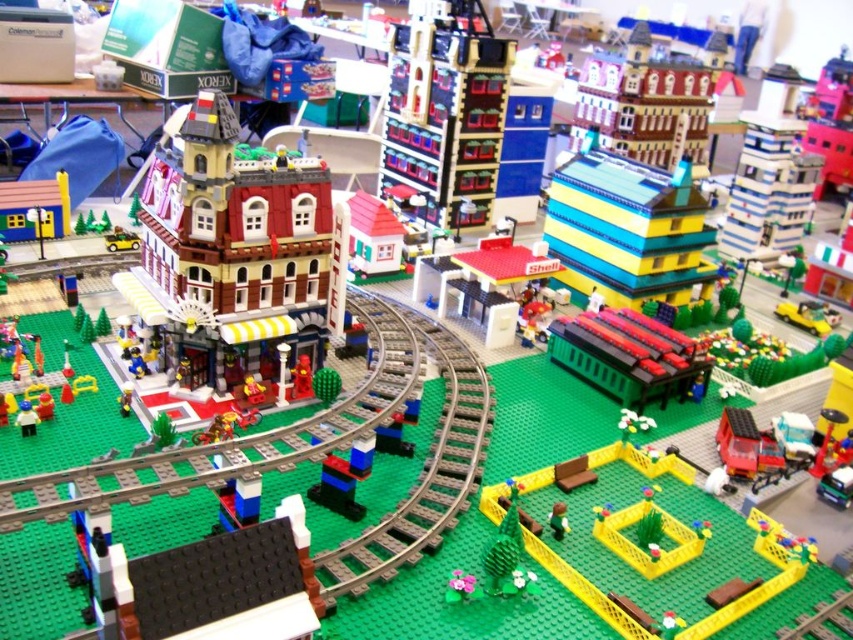
You are standing in the Lego cityscape and want to reach the point at coordinates (790, 584). If your current position is 30 inches away from the central red building, how much closer do you need to move to reach the point?

The point at coordinates (790, 584) is 37.02 inches from the viewer. Since you are currently 30 inches away from the central red building, you need to move 7.02 inches closer to reach the point.

You are a Lego figure standing on the green baseplate and want to reach the yellow plastic maze at center. Which direction should you move to get there?

The yellow plastic maze at center is located at point (637, 547), so you should move towards the center of the image to reach it.

You are standing at the point with coordinates point (645, 552) in the Lego cityscape. Looking towards the direction of the multi story building with a red facade, is the point (650, 173) located behind or in front of you?

The point (650, 173) is behind point (645, 552), so it is located behind you.